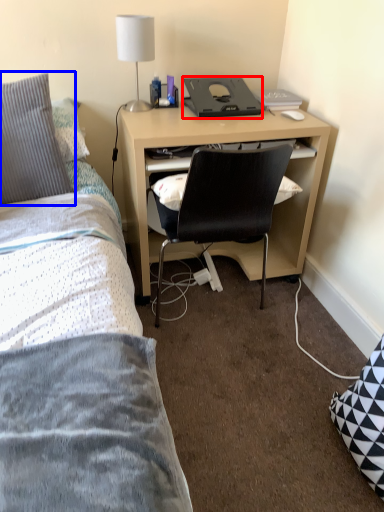
Question: Which of the following is the farthest to the observer, desktop (highlighted by a red box) or pillow (highlighted by a blue box)?

Choices:
 (A) desktop
 (B) pillow

Answer: (A)